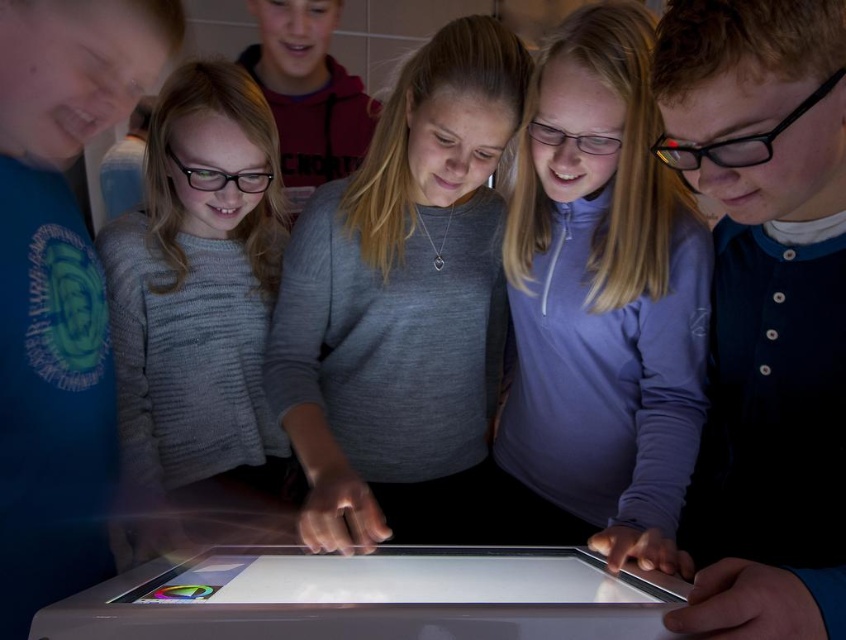
Question: Estimate the real-world distances between objects in this image. Which object is farther from the knitted gray sweater at center?

Choices:
 (A) purple fleece jacket at center
 (B) silver metallic tablet at center
 (C) matte black glasses at center
 (D) gray sweater at center

Answer: (C)

Question: Which object appears closest to the camera in this image?

Choices:
 (A) gray sweater at center
 (B) knitted gray sweater at center

Answer: (A)

Question: Can you confirm if matte black glasses at center is smaller than silver metallic tablet at center?

Choices:
 (A) no
 (B) yes

Answer: (A)

Question: Is matte black glasses at center to the left of knitted gray sweater at center from the viewer's perspective?

Choices:
 (A) yes
 (B) no

Answer: (B)

Question: From the image, what is the correct spatial relationship of gray sweater at center in relation to purple fleece jacket at center?

Choices:
 (A) right
 (B) left

Answer: (B)

Question: Estimate the real-world distances between objects in this image. Which object is farther from the purple fleece jacket at center?

Choices:
 (A) gray sweater at center
 (B) matte black glasses at center
 (C) silver metallic tablet at center
 (D) knitted gray sweater at center

Answer: (D)